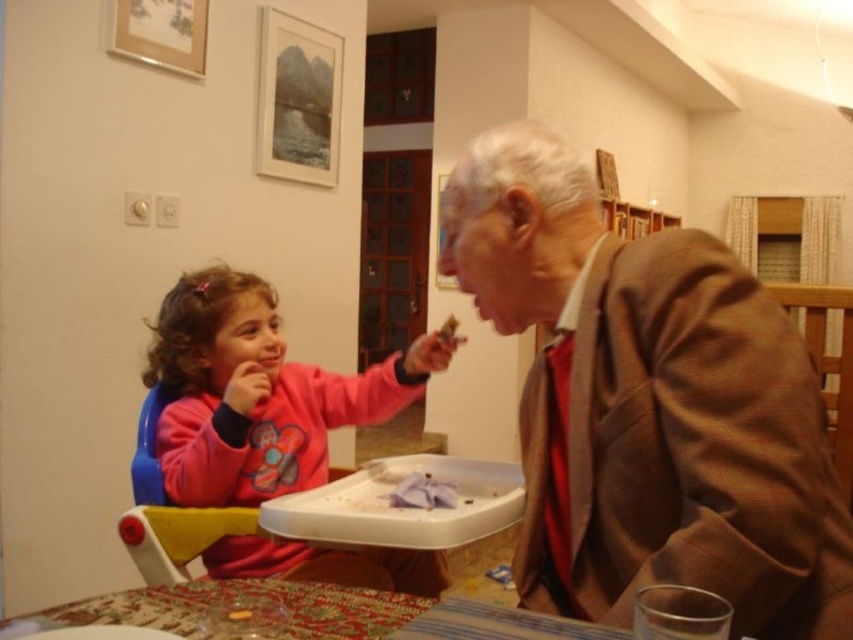
Question: Can you confirm if brown textured suit at right is bigger than pink fleece sweater at left?

Choices:
 (A) yes
 (B) no

Answer: (B)

Question: Which point is farther to the camera?

Choices:
 (A) brown textured suit at right
 (B) yellow plastic chair at lower left
 (C) pink fleece sweater at left
 (D) white crumb at upper center

Answer: (D)

Question: Among these objects, which one is nearest to the camera?

Choices:
 (A) yellow plastic chair at lower left
 (B) brown textured suit at right
 (C) pink fleece sweater at left

Answer: (B)

Question: In this image, where is pink fleece sweater at left located relative to white crumb at upper center?

Choices:
 (A) below
 (B) above

Answer: (A)

Question: Which point is closer to the camera?

Choices:
 (A) white crumb at upper center
 (B) brown textured suit at right

Answer: (B)

Question: Can you confirm if brown textured suit at right is wider than pink fleece sweater at left?

Choices:
 (A) yes
 (B) no

Answer: (B)